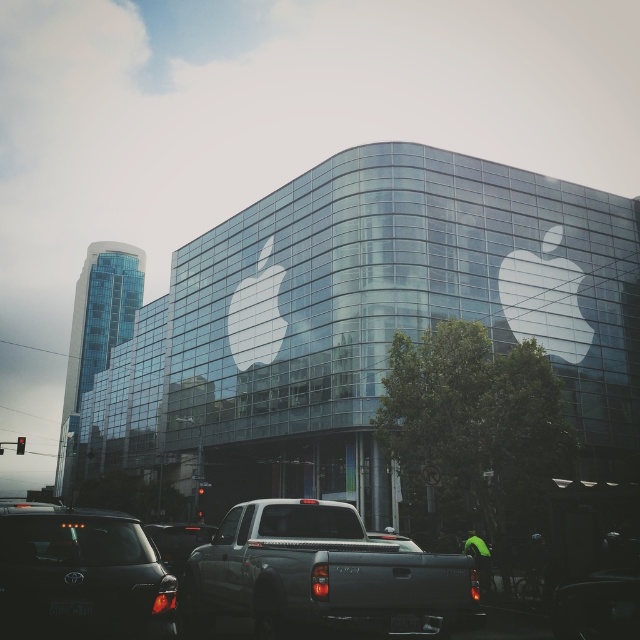
Is matte gray pickup truck at center to the left of matte black car at lower left from the viewer's perspective?

In fact, matte gray pickup truck at center is to the right of matte black car at lower left.

Can you confirm if matte gray pickup truck at center is thinner than matte black car at lower left?

No.

This screenshot has height=640, width=640. Describe the element at coordinates (320, 576) in the screenshot. I see `matte gray pickup truck at center` at that location.

The height and width of the screenshot is (640, 640). In order to click on matte gray pickup truck at center in this screenshot , I will do `click(320, 576)`.